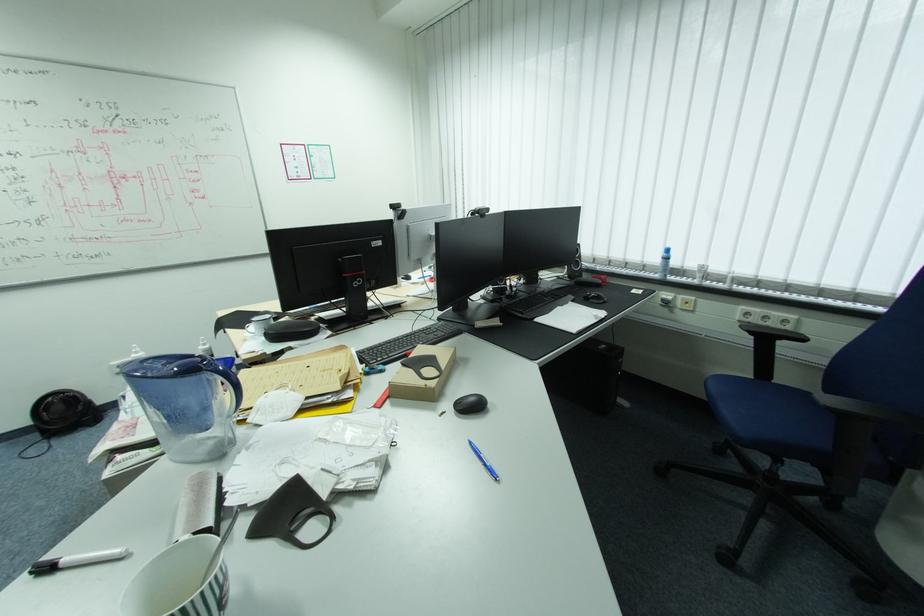
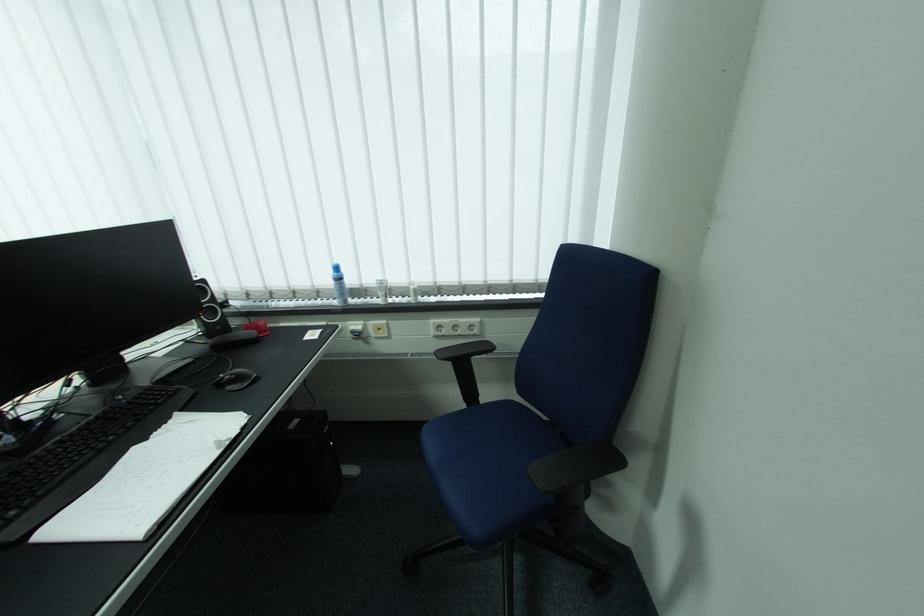
Where in the second image is the point corresponding to point 663,276 from the first image?

(342, 302)